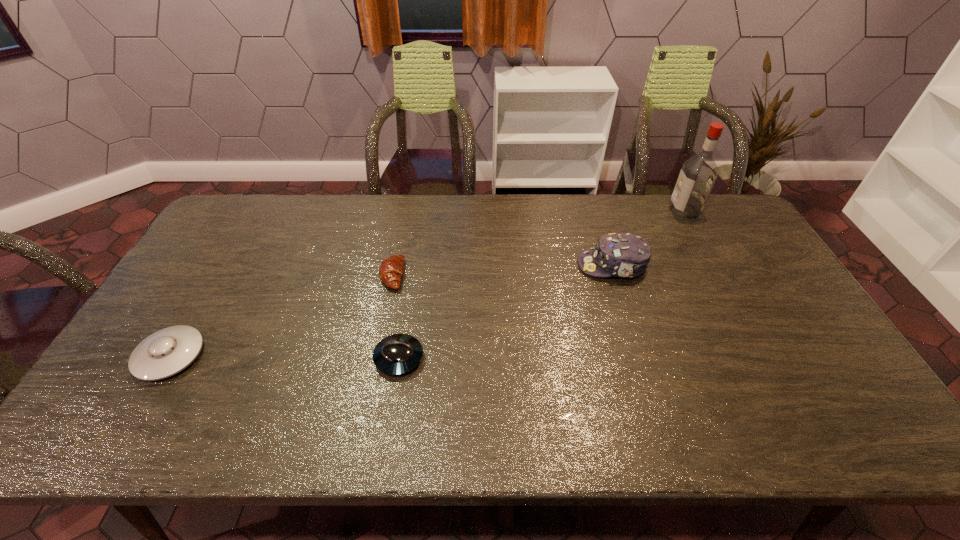
Locate an element on the screen. Image resolution: width=960 pixels, height=540 pixels. empty location between the headwear and the right saucer is located at coordinates (506, 312).

The width and height of the screenshot is (960, 540). I want to click on vacant space that's between the left saucer and the crescent roll, so click(281, 315).

Locate an element on the screen. The height and width of the screenshot is (540, 960). free space that is in between the left saucer and the second object from right to left is located at coordinates (392, 310).

The width and height of the screenshot is (960, 540). What are the coordinates of `vacant space in between the headwear and the left saucer` in the screenshot? It's located at (392, 310).

Identify the location of free spot between the leftmost object and the liquor. (427, 283).

The width and height of the screenshot is (960, 540). What are the coordinates of `the closest object relative to the crescent roll` in the screenshot? It's located at (397, 354).

Locate which object ranks in proximity to the right saucer. Please provide its 2D coordinates. Your answer should be formatted as a tuple, i.e. [(x, y)], where the tuple contains the x and y coordinates of a point satisfying the conditions above.

[(391, 269)]

This screenshot has height=540, width=960. Identify the location of free location that satisfies the following two spatial constraints: 1. on the front-facing side of the fourth shortest object; 2. on the front side of the shorter saucer. (641, 357).